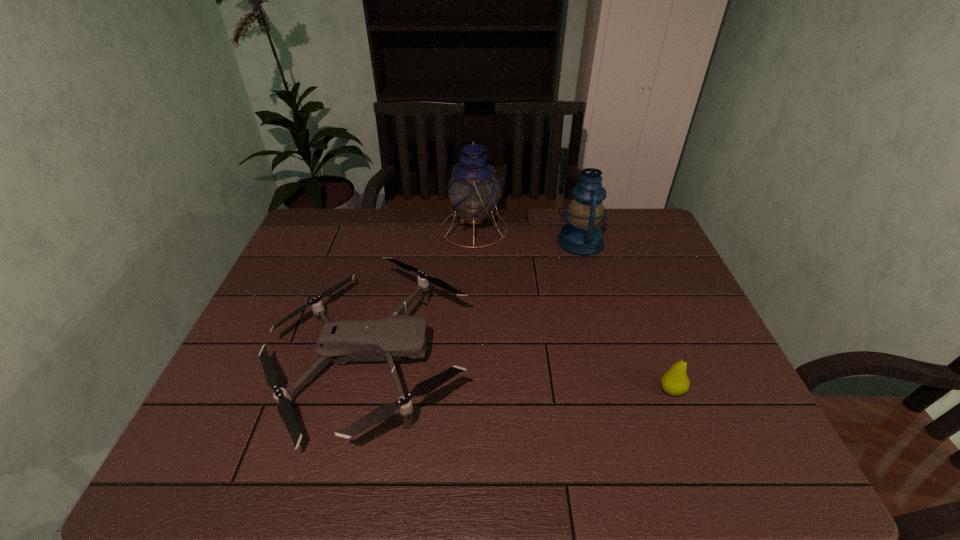
The image size is (960, 540). In order to click on free spot that satisfies the following two spatial constraints: 1. on the front-facing side of the tallest object; 2. on the right side of the rightmost object in this screenshot , I will do `click(471, 390)`.

You are a GUI agent. You are given a task and a screenshot of the screen. Output one action in this format:
    pyautogui.click(x=<x>, y=<y>)
    Task: Click on the vacant space that satisfies the following two spatial constraints: 1. on the front-facing side of the drone; 2. on the right side of the pear
    
    Given the screenshot: What is the action you would take?
    pyautogui.click(x=364, y=390)

The width and height of the screenshot is (960, 540). I want to click on free space that satisfies the following two spatial constraints: 1. on the front-facing side of the pear; 2. on the left side of the tallest object, so click(471, 390).